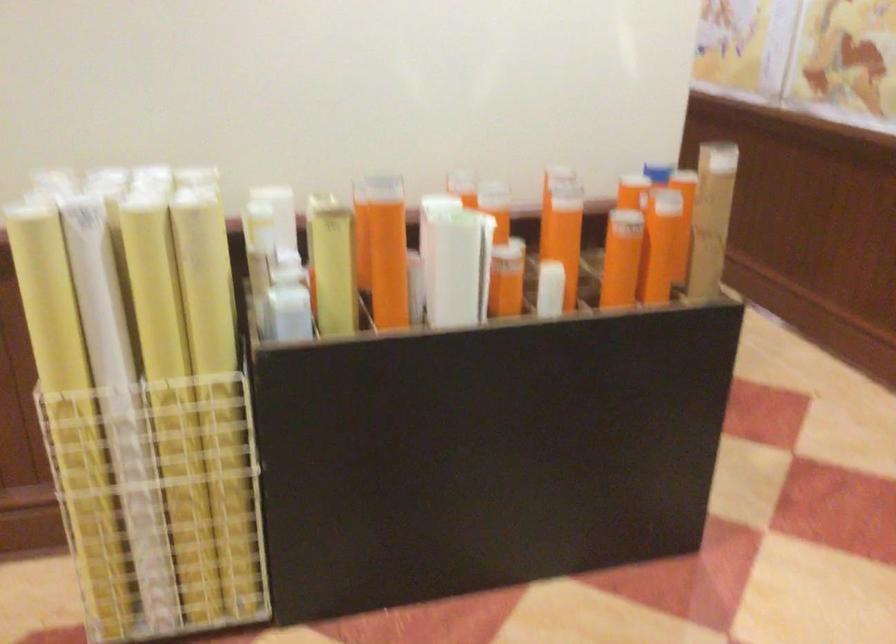
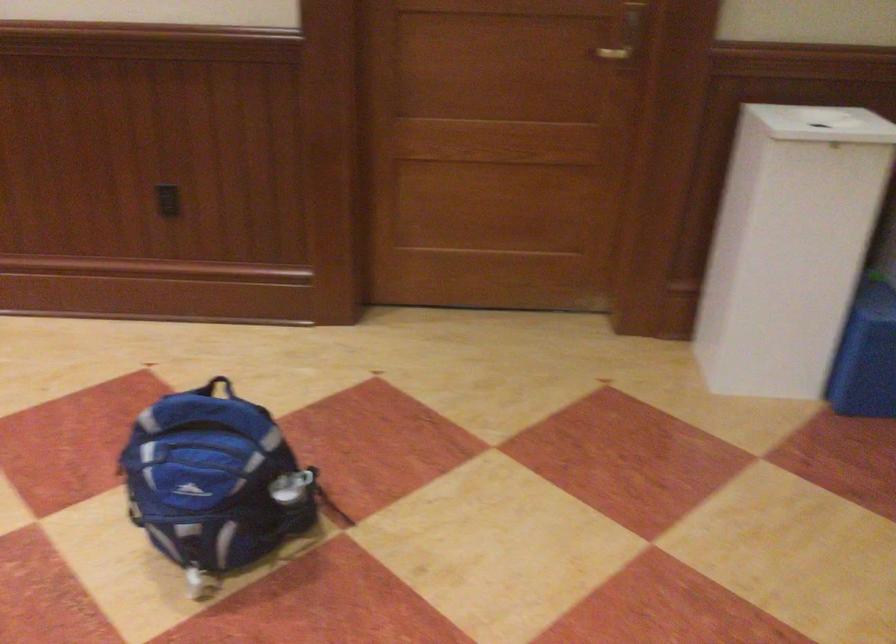
Question: The camera is either moving clockwise (left) or counter-clockwise (right) around the object. The first image is from the beginning of the video and the second image is from the end. Is the camera moving left or right when shooting the video?

Choices:
 (A) Left
 (B) Right

Answer: (A)